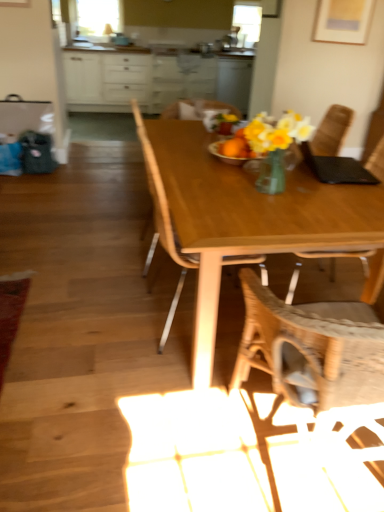
Where is `vacant space to the left of wooden table at center`? The image size is (384, 512). vacant space to the left of wooden table at center is located at coordinates (80, 260).